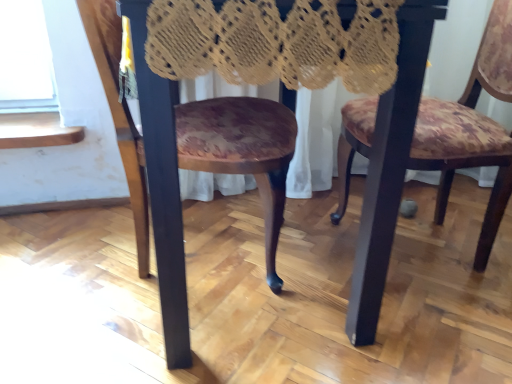
This screenshot has width=512, height=384. Find the location of `vacant space to the left of wooden table at center`. vacant space to the left of wooden table at center is located at coordinates (68, 264).